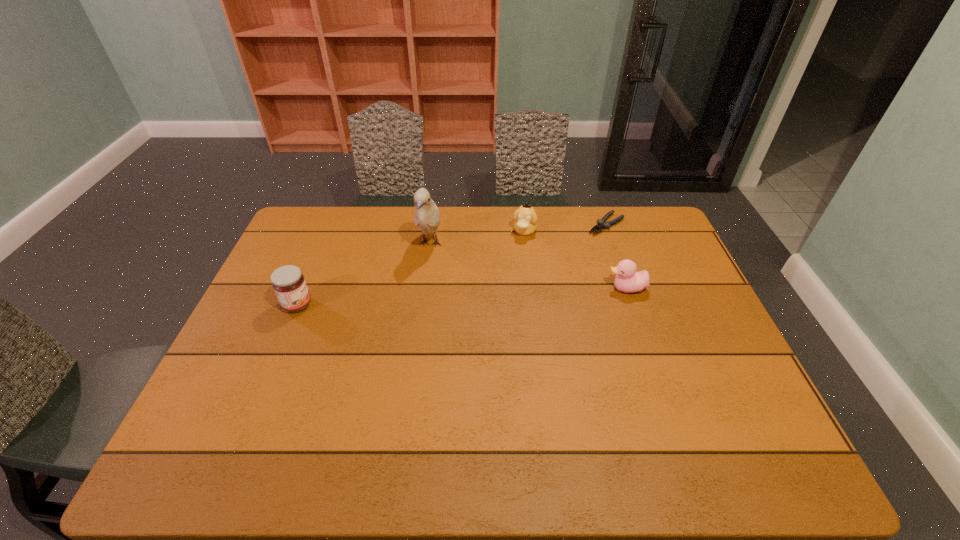
This screenshot has width=960, height=540. I want to click on jam, so click(289, 284).

In order to click on the right duckling in this screenshot , I will do `click(627, 280)`.

Find the location of a particular element. This screenshot has height=540, width=960. the shorter duckling is located at coordinates (627, 280).

Find the location of `the third object from right to left`. the third object from right to left is located at coordinates (525, 217).

Where is `the left duckling`? The image size is (960, 540). the left duckling is located at coordinates (525, 217).

Find the location of a particular element. the second object from left to right is located at coordinates (426, 216).

Identify the location of bird. The height and width of the screenshot is (540, 960). (426, 216).

Identify the location of pliers. The height and width of the screenshot is (540, 960). (601, 225).

I want to click on vacant space located on the right of the leftmost object, so click(x=370, y=305).

Where is `free location located 0.220m on the front-facing side of the nearer duckling`? This screenshot has height=540, width=960. free location located 0.220m on the front-facing side of the nearer duckling is located at coordinates (535, 288).